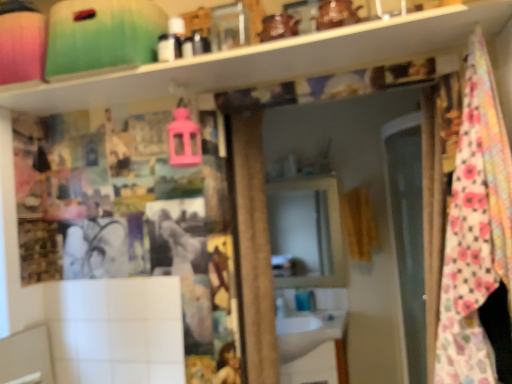
Question: Choose the correct answer: Is matte black toiletries at upper center inside white glossy sink at center or outside it?

Choices:
 (A) outside
 (B) inside

Answer: (A)

Question: Looking at the image, does matte black toiletries at upper center seem bigger or smaller compared to white glossy sink at center?

Choices:
 (A) big
 (B) small

Answer: (B)

Question: Which is nearer to the matte black toiletries at upper center?

Choices:
 (A) blue glossy faucet at lower center
 (B) white glossy sink at center
 (C) yellow fabric curtain at right
 (D) floral cotton blanket at right

Answer: (D)

Question: Which object is the closest to the floral cotton blanket at right?

Choices:
 (A) matte black toiletries at upper center
 (B) yellow fabric curtain at right
 (C) blue glossy faucet at lower center
 (D) white glossy sink at center

Answer: (A)